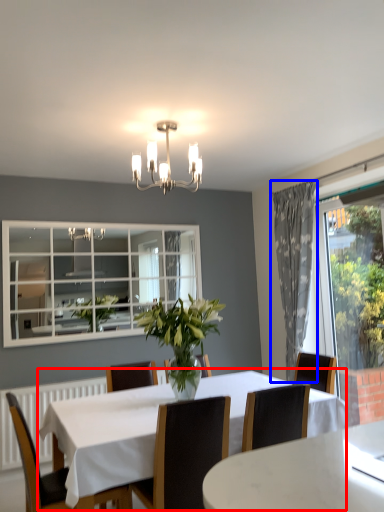
Question: Which object appears farthest to the camera in this image, kitchen & dining room table (highlighted by a red box) or curtain (highlighted by a blue box)?

Choices:
 (A) kitchen & dining room table
 (B) curtain

Answer: (B)